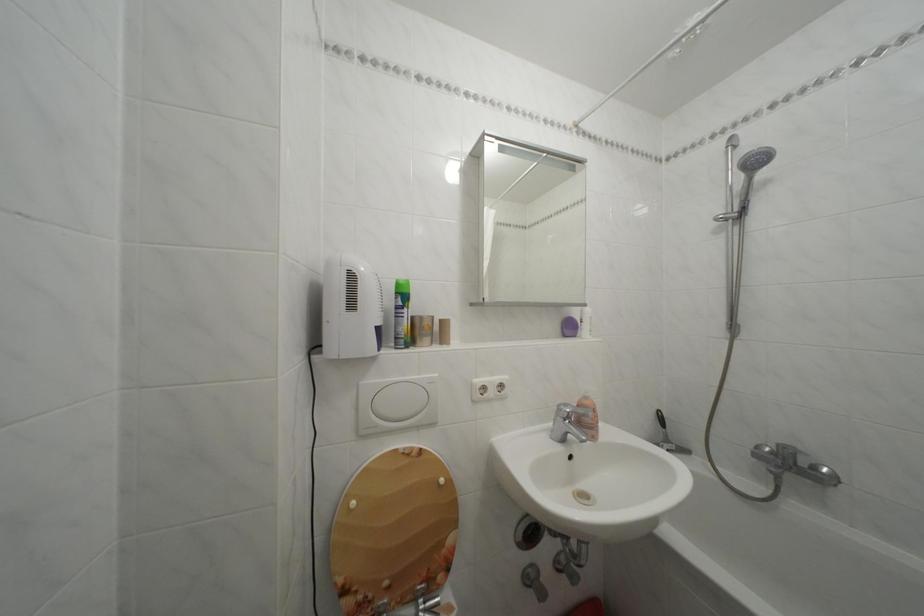
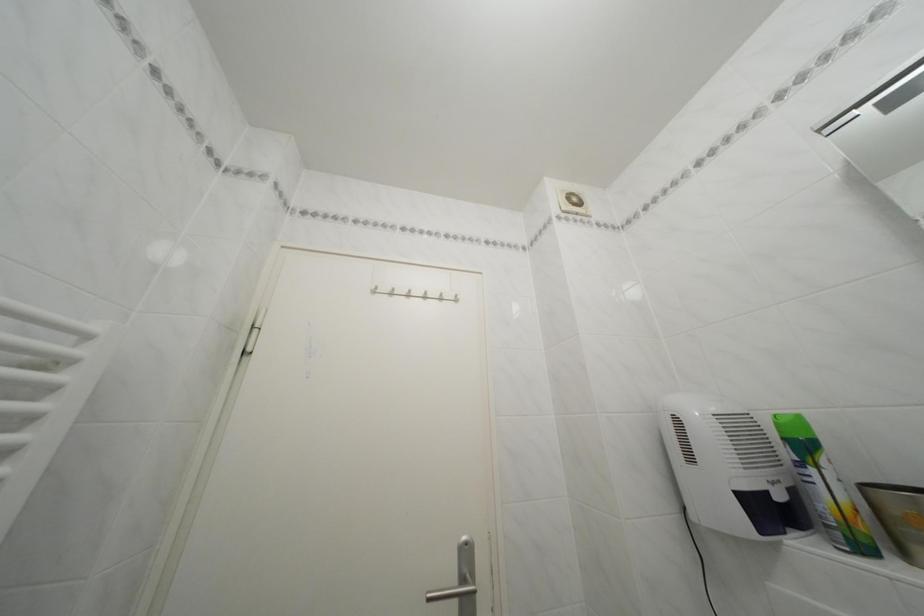
The point at [406,300] is marked in the first image. Where is the corresponding point in the second image?

(793, 445)